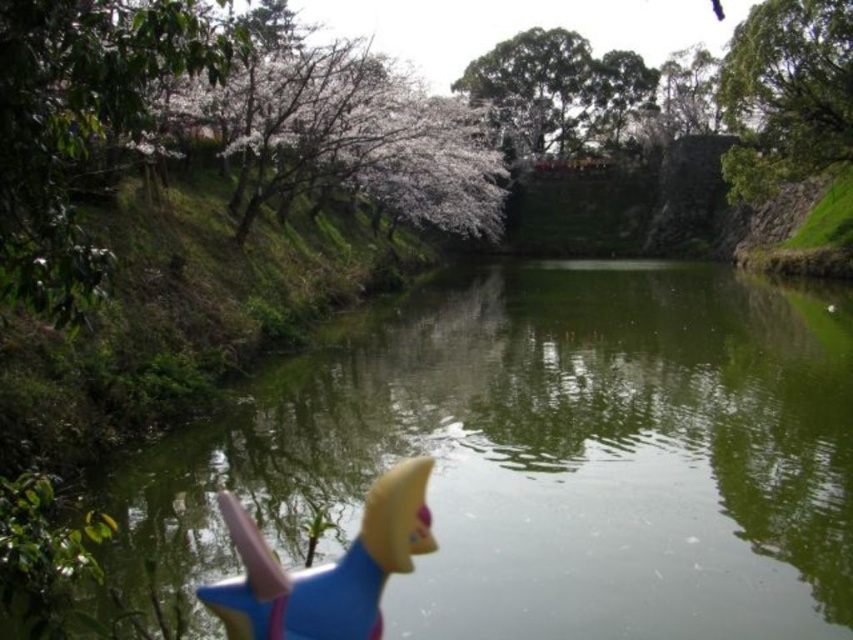
Question: Is white blossoms at upper left to the right of blue rubber toy at lower center from the viewer's perspective?

Choices:
 (A) no
 (B) yes

Answer: (A)

Question: Does white blossoms at left appear on the right side of blue rubber toy at lower center?

Choices:
 (A) yes
 (B) no

Answer: (B)

Question: Which point is closer to the camera?

Choices:
 (A) green leafy tree at upper right
 (B) white blossoms at upper left

Answer: (B)

Question: In this image, where is green smooth water at center located relative to blue rubber toy at lower center?

Choices:
 (A) left
 (B) right

Answer: (B)

Question: Which point is farther to the camera?

Choices:
 (A) (22, 17)
 (B) (496, 189)
 (C) (718, 467)
 (D) (845, 1)

Answer: (B)

Question: Estimate the real-world distances between objects in this image. Which object is closer to the blue rubber toy at lower center?

Choices:
 (A) green smooth water at center
 (B) white blossoms at upper left
 (C) green leafy tree at upper right
 (D) white blossoms at left

Answer: (D)